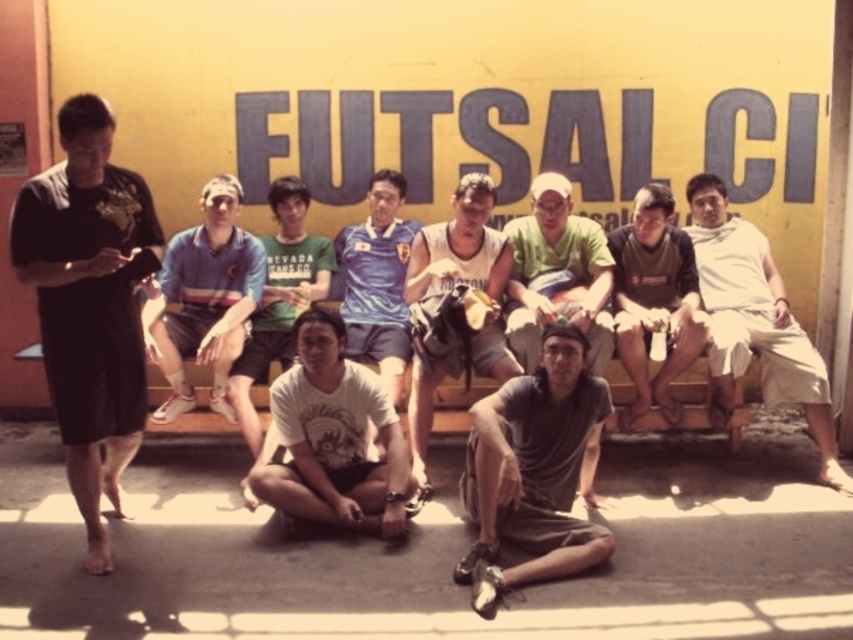
Who is taller, white cotton shirt at center or white cotton t-shirt at center?

white cotton t-shirt at center

Based on the photo, is white cotton shirt at center positioned before white cotton t-shirt at center?

No, it is behind white cotton t-shirt at center.

This screenshot has width=853, height=640. I want to click on white cotton shirt at center, so click(x=755, y=321).

Between point (722, 276) and point (260, 278), which one is positioned in front?

Point (260, 278) is more forward.

Describe the element at coordinates (755, 321) in the screenshot. This screenshot has width=853, height=640. I see `white cotton shirt at center` at that location.

Locate an element on the screen. The width and height of the screenshot is (853, 640). white cotton shirt at center is located at coordinates (755, 321).

Who is lower down, blue striped jersey at center or white jersey at center?

Positioned lower is white jersey at center.

Between blue striped jersey at center and white jersey at center, which one appears on the left side from the viewer's perspective?

Positioned to the left is blue striped jersey at center.

Between point (170, 285) and point (479, 284), which one is positioned behind?

Positioned behind is point (170, 285).

Identify the location of blue striped jersey at center. The height and width of the screenshot is (640, 853). (204, 298).